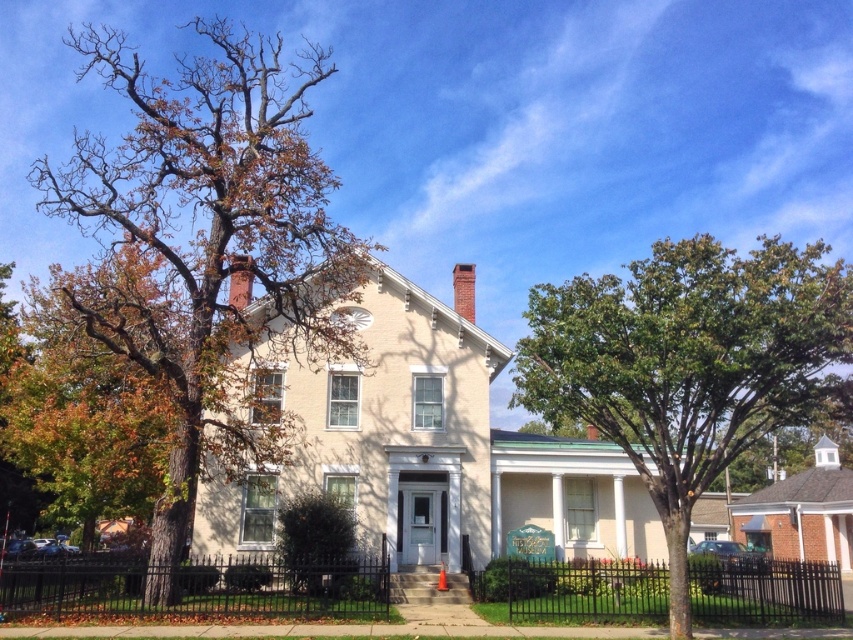
You are standing at the front door of the house and want to plant a new tree in your garden. The existing green leafy tree at right is located at point 0.569, 0.807. If you want to plant a new tree exactly 0.3 meters to the left of the existing tree, what would be the new coordinate for the new tree?

The new coordinate would be calculated by subtracting 0.3 from the x coordinate of the existing green leafy tree at right. The existing tree is at 0.569, so subtracting 0.3 gives 0.269. The new coordinate is therefore (688,172).

You are a landscape architect designing a garden for this house. You need to place a new bench that requires at least 3 meters of space. Given the green leafy tree at right and the black wrought iron fence at lower center, which object provides enough space for the bench?

The green leafy tree at right has a larger width than the black wrought iron fence at lower center. Since the bench requires at least 3 meters of space, the green leafy tree at right likely provides sufficient space compared to the narrower fence.

You are standing in front of the house and see a point marked at coordinates (207, 250). Based on the scene description, can you identify what object this point is located on?

The point at (207, 250) is located on the brown leafy tree at left.